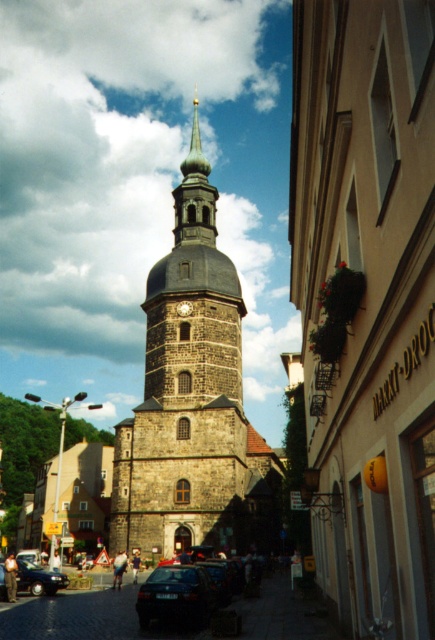
Is smooth gray spire at center in front of dark gray stone clock at center?

No, smooth gray spire at center is behind dark gray stone clock at center.

The height and width of the screenshot is (640, 435). What do you see at coordinates (194, 195) in the screenshot? I see `smooth gray spire at center` at bounding box center [194, 195].

Who is more forward, (184,189) or (188,307)?

Positioned in front is point (188,307).

Image resolution: width=435 pixels, height=640 pixels. I want to click on smooth gray spire at center, so click(x=194, y=195).

Can you confirm if shiny black sedan at lower left is shorter than dark gray stone clock at center?

In fact, shiny black sedan at lower left may be taller than dark gray stone clock at center.

The height and width of the screenshot is (640, 435). What do you see at coordinates (39, 579) in the screenshot?
I see `shiny black sedan at lower left` at bounding box center [39, 579].

Image resolution: width=435 pixels, height=640 pixels. Find the location of `shiny black sedan at lower left`. shiny black sedan at lower left is located at coordinates (39, 579).

How much distance is there between dark blue matte car at lower center and dark gray stone clock at center?

113.18 feet

What do you see at coordinates (177, 595) in the screenshot? I see `dark blue matte car at lower center` at bounding box center [177, 595].

Identify the location of dark blue matte car at lower center. Image resolution: width=435 pixels, height=640 pixels. (177, 595).